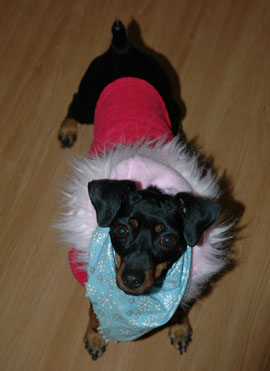
Locate an element on the screen. coat is located at coordinates (147, 170).